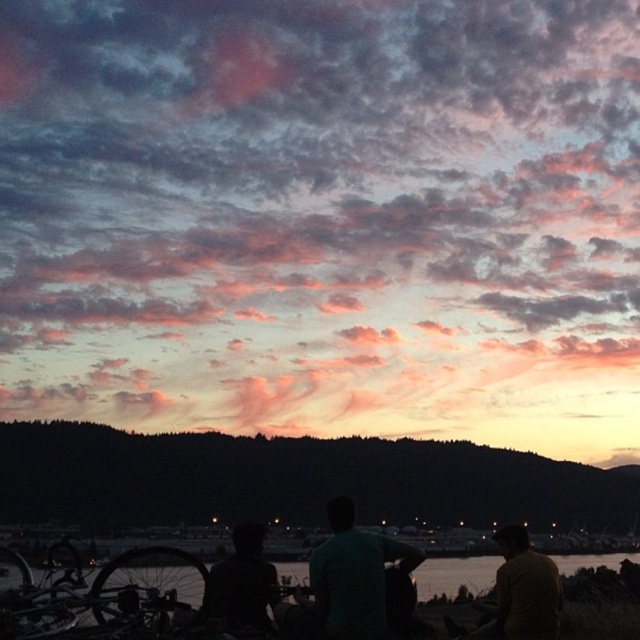
Locate an element on the screen. The height and width of the screenshot is (640, 640). silhouette figure at center is located at coordinates (243, 584).

Is point (266, 588) positioned before point (444, 564)?

Yes, it is in front of point (444, 564).

Which is behind, point (228, 579) or point (300, 566)?

Positioned behind is point (300, 566).

Where is `silhouette figure at center`? This screenshot has height=640, width=640. silhouette figure at center is located at coordinates (243, 584).

Which is below, yellow matte shirt at lower right or silhouette figure at center?

yellow matte shirt at lower right

Can you confirm if yellow matte shirt at lower right is positioned to the left of silhouette figure at center?

No, yellow matte shirt at lower right is not to the left of silhouette figure at center.

Is point (496, 612) farther from viewer compared to point (264, 586)?

Yes, point (496, 612) is farther from viewer.

Find the location of a particular element. yellow matte shirt at lower right is located at coordinates (522, 589).

Who is lower down, yellow matte shirt at lower right or transparent water at lower center?

transparent water at lower center

Who is taller, yellow matte shirt at lower right or transparent water at lower center?

Result: transparent water at lower center is taller.

Between point (497, 618) and point (282, 563), which one is positioned behind?

Positioned behind is point (282, 563).

This screenshot has width=640, height=640. Find the location of `yellow matte shirt at lower right`. yellow matte shirt at lower right is located at coordinates (522, 589).